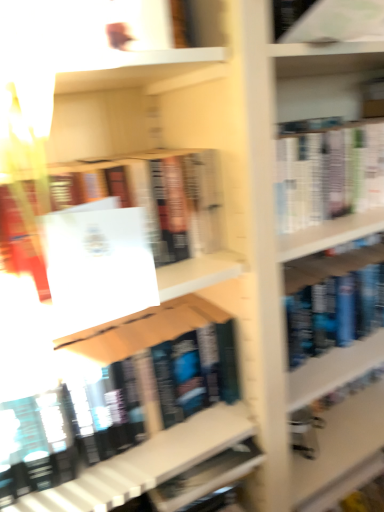
Question: Is white matte paper at center positioned beyond the bounds of white paper at upper right, which appears as the first book when viewed from the top?

Choices:
 (A) no
 (B) yes

Answer: (B)

Question: Does white matte paper at center contain white paper at upper right, the 3th book in the bottom-to-top sequence?

Choices:
 (A) yes
 (B) no

Answer: (B)

Question: Is white matte paper at center aimed at white paper at upper right, which appears as the first book when viewed from the top?

Choices:
 (A) yes
 (B) no

Answer: (B)

Question: Does white matte paper at center appear on the right side of white paper at upper right, which appears as the first book when viewed from the top?

Choices:
 (A) yes
 (B) no

Answer: (B)

Question: From the image's perspective, is white matte paper at center located beneath white paper at upper right, which appears as the first book when viewed from the top?

Choices:
 (A) no
 (B) yes

Answer: (B)

Question: Considering the positions of white matte paper at center and matte black book at center, which appears as the first book when ordered from the bottom, in the image, is white matte paper at center taller or shorter than matte black book at center, which appears as the first book when ordered from the bottom,?

Choices:
 (A) short
 (B) tall

Answer: (A)

Question: From a real-world perspective, is white matte paper at center positioned above or below matte black book at center, marked as the third book in a top-to-bottom arrangement?

Choices:
 (A) above
 (B) below

Answer: (A)

Question: Considering the positions of point (56, 273) and point (185, 458), is point (56, 273) closer or farther from the camera than point (185, 458)?

Choices:
 (A) farther
 (B) closer

Answer: (B)

Question: In terms of size, does white matte paper at center appear bigger or smaller than matte black book at center, marked as the third book in a top-to-bottom arrangement?

Choices:
 (A) small
 (B) big

Answer: (A)

Question: Would you say white paper at upper right, which appears as the first book when viewed from the top, is inside or outside white matte paper at center?

Choices:
 (A) outside
 (B) inside

Answer: (A)

Question: Considering the positions of white paper at upper right, the 3th book in the bottom-to-top sequence, and white matte paper at center in the image, is white paper at upper right, the 3th book in the bottom-to-top sequence, wider or thinner than white matte paper at center?

Choices:
 (A) wide
 (B) thin

Answer: (A)

Question: Is point (380, 17) positioned closer to the camera than point (140, 265)?

Choices:
 (A) farther
 (B) closer

Answer: (A)

Question: From a real-world perspective, is white paper at upper right, which appears as the first book when viewed from the top, above or below white matte paper at center?

Choices:
 (A) below
 (B) above

Answer: (B)

Question: From the image's perspective, is white paper at upper center, the second book from the top, positioned above or below matte black book at center, which appears as the first book when ordered from the bottom?

Choices:
 (A) above
 (B) below

Answer: (A)

Question: Based on their sizes in the image, would you say white paper at upper center, which is the second book from bottom to top, is bigger or smaller than matte black book at center, which appears as the first book when ordered from the bottom?

Choices:
 (A) small
 (B) big

Answer: (A)